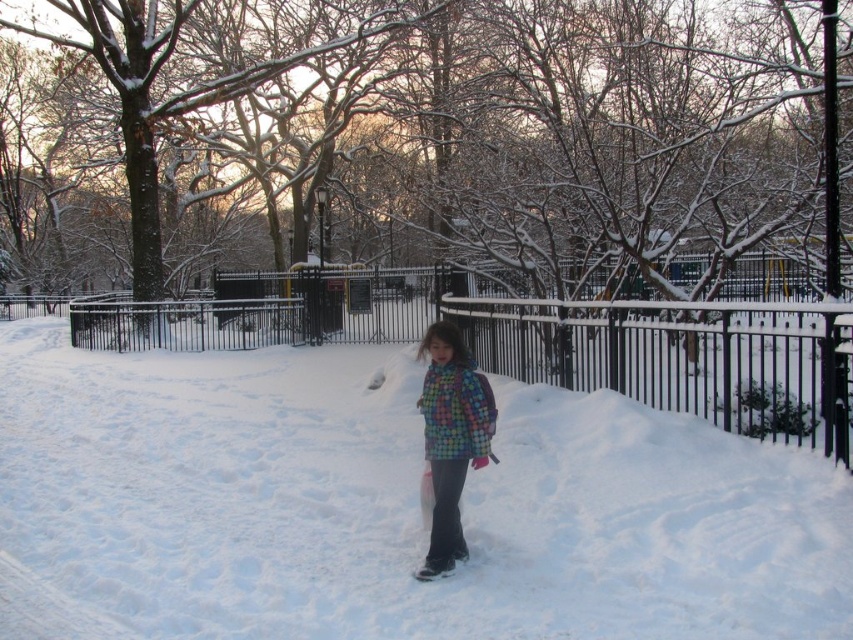
Question: Which point appears closest to the camera in this image?

Choices:
 (A) [x=456, y=460]
 (B) [x=44, y=404]

Answer: (A)

Question: Which point is farther to the camera?

Choices:
 (A) (729, 556)
 (B) (581, 360)
 (C) (450, 490)

Answer: (B)

Question: Among these objects, which one is nearest to the camera?

Choices:
 (A) multicolored quilted jacket at center
 (B) black metal fence at center

Answer: (A)

Question: Can you confirm if white fluffy snow at center is positioned to the right of black metal fence at center?

Choices:
 (A) yes
 (B) no

Answer: (A)

Question: Where is white fluffy snow at center located in relation to black metal fence at center in the image?

Choices:
 (A) below
 (B) above

Answer: (A)

Question: Observing the image, what is the correct spatial positioning of white fluffy snow at center in reference to black metal fence at center?

Choices:
 (A) left
 (B) right

Answer: (B)